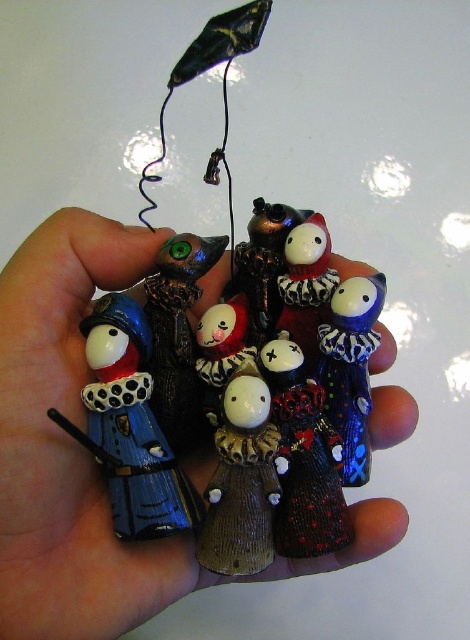
Is shiny metallic figure at center to the right of blue glossy clown at center from the viewer's perspective?

No, shiny metallic figure at center is not to the right of blue glossy clown at center.

Is point (318, 413) farther from camera compared to point (361, 465)?

No, it is not.

Where is `shiny metallic figure at center`? The height and width of the screenshot is (640, 470). shiny metallic figure at center is located at coordinates (304, 456).

Is point (180, 339) closer to viewer compared to point (357, 323)?

No, it is not.

At what (x,y) coordinates should I click in order to perform the action: click on matte black raven at center. Please return your answer as a coordinate pair (x, y). The width and height of the screenshot is (470, 640). Looking at the image, I should click on (178, 332).

You are a GUI agent. You are given a task and a screenshot of the screen. Output one action in this format:
    pyautogui.click(x=<x>, y=<y>)
    Task: Click on the matte black raven at center
    The width and height of the screenshot is (470, 640).
    Given the screenshot: What is the action you would take?
    pyautogui.click(x=178, y=332)

Does shiny metallic figure at center appear over porcelain clown at center?

Actually, shiny metallic figure at center is below porcelain clown at center.

Can you confirm if shiny metallic figure at center is positioned to the left of porcelain clown at center?

Indeed, shiny metallic figure at center is positioned on the left side of porcelain clown at center.

Is point (291, 397) more distant than point (303, 228)?

No, it is not.

Locate an element on the screen. This screenshot has width=470, height=640. shiny metallic figure at center is located at coordinates (304, 456).